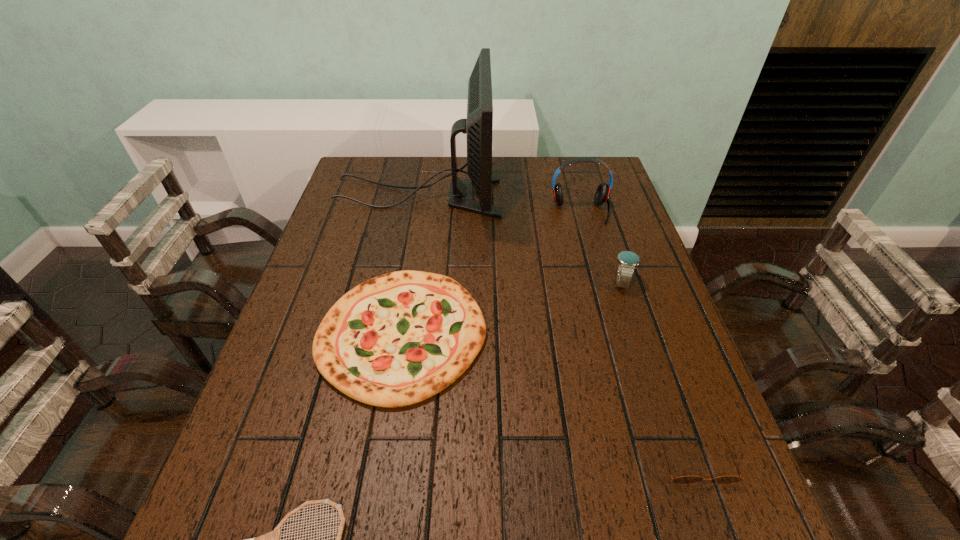
Where is `computer monitor`? computer monitor is located at coordinates (478, 126).

You are a GUI agent. You are given a task and a screenshot of the screen. Output one action in this format:
    pyautogui.click(x=<x>, y=<y>)
    Task: Click on the second tallest object
    The height and width of the screenshot is (540, 960).
    Given the screenshot: What is the action you would take?
    pyautogui.click(x=602, y=193)

Identify the location of the third tallest object. (627, 260).

Locate an element on the screen. pizza is located at coordinates (397, 339).

This screenshot has width=960, height=540. In order to click on the fifth farthest object in this screenshot , I will do `click(684, 479)`.

Image resolution: width=960 pixels, height=540 pixels. Identify the location of sunglasses. (684, 479).

Locate an element on the screen. The image size is (960, 540). free space located on the screen side of the computer monitor is located at coordinates (556, 196).

Image resolution: width=960 pixels, height=540 pixels. In order to click on vacant space located 0.280m with the microphone attached to the side of the headset in this screenshot , I will do (602, 292).

You are a GUI agent. You are given a task and a screenshot of the screen. Output one action in this format:
    pyautogui.click(x=<x>, y=<y>)
    Task: Click on the vacant area situated 0.110m on the left of the third tallest object
    
    Given the screenshot: What is the action you would take?
    pyautogui.click(x=569, y=282)

Where is `vacant point located 0.190m on the front of the pizza`? The height and width of the screenshot is (540, 960). vacant point located 0.190m on the front of the pizza is located at coordinates (373, 512).